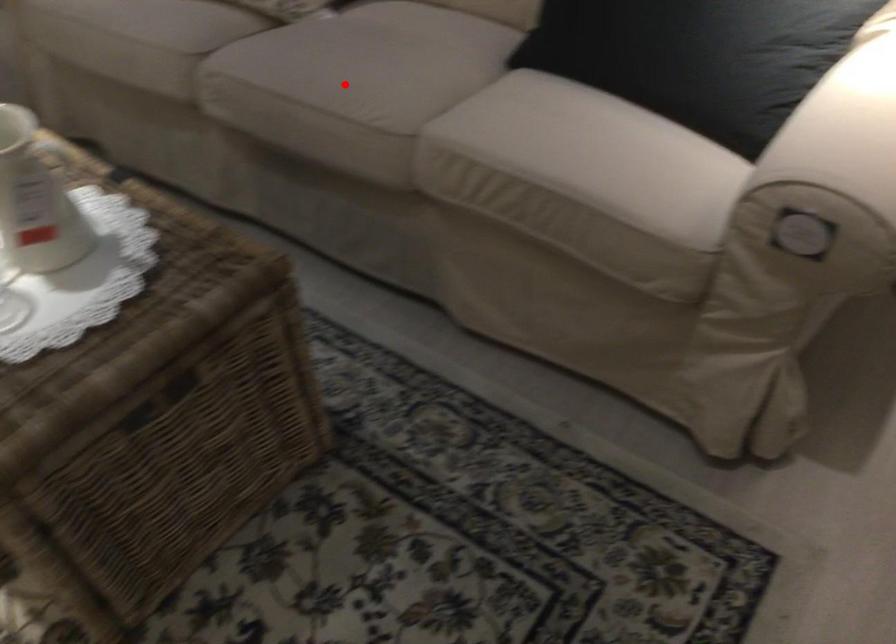
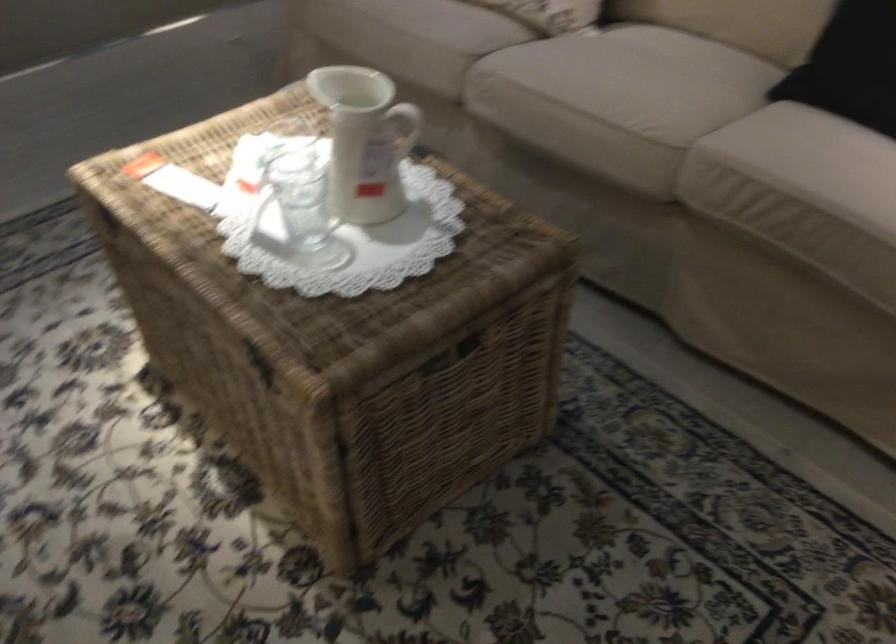
The point at the highlighted location is marked in the first image. Where is the corresponding point in the second image?

(617, 93)